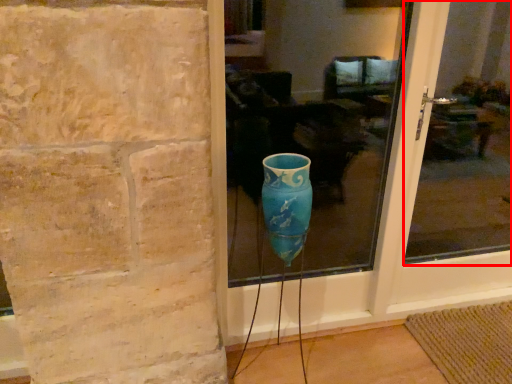
Question: From the image's perspective, where is glass window (annotated by the red box) located relative to glass window?

Choices:
 (A) above
 (B) below

Answer: (B)